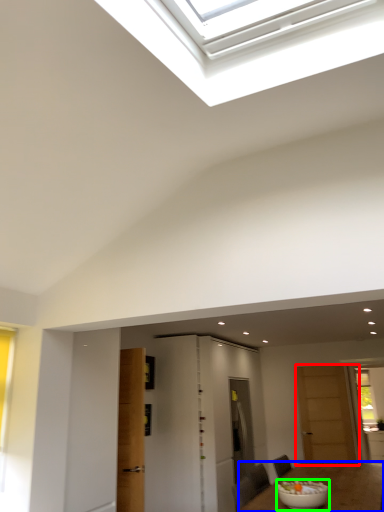
Question: Based on their relative distances, which object is nearer to door (highlighted by a red box)? Choose from table (highlighted by a blue box) and bowl (highlighted by a green box).

Choices:
 (A) table
 (B) bowl

Answer: (A)